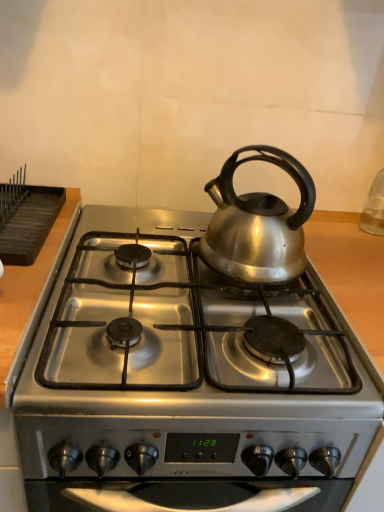
Question: Is black matte rack at upper left behind silver metallic kettle at center?

Choices:
 (A) no
 (B) yes

Answer: (B)

Question: Is black matte rack at upper left closer to the viewer compared to silver metallic kettle at center?

Choices:
 (A) yes
 (B) no

Answer: (B)

Question: Does black matte rack at upper left appear on the right side of silver metallic kettle at center?

Choices:
 (A) yes
 (B) no

Answer: (B)

Question: Is black matte rack at upper left thinner than silver metallic kettle at center?

Choices:
 (A) yes
 (B) no

Answer: (B)

Question: Is silver metallic kettle at center at the back of black matte rack at upper left?

Choices:
 (A) yes
 (B) no

Answer: (B)

Question: Choose the correct answer: Is silver metallic kettle at center inside black matte rack at upper left or outside it?

Choices:
 (A) outside
 (B) inside

Answer: (A)

Question: Looking at the image, does silver metallic kettle at center seem bigger or smaller compared to black matte rack at upper left?

Choices:
 (A) big
 (B) small

Answer: (A)

Question: From their relative heights in the image, would you say silver metallic kettle at center is taller or shorter than black matte rack at upper left?

Choices:
 (A) tall
 (B) short

Answer: (A)

Question: Does point (236, 160) appear closer or farther from the camera than point (23, 242)?

Choices:
 (A) closer
 (B) farther

Answer: (B)

Question: In the image, is satin silver gas stove at center on the left side or the right side of black matte rack at upper left?

Choices:
 (A) left
 (B) right

Answer: (B)

Question: Considering the positions of satin silver gas stove at center and black matte rack at upper left in the image, is satin silver gas stove at center wider or thinner than black matte rack at upper left?

Choices:
 (A) thin
 (B) wide

Answer: (B)

Question: From the image's perspective, is satin silver gas stove at center positioned above or below black matte rack at upper left?

Choices:
 (A) below
 (B) above

Answer: (A)

Question: Does point (248, 453) appear closer or farther from the camera than point (31, 251)?

Choices:
 (A) closer
 (B) farther

Answer: (A)

Question: Is black matte rack at upper left in front of or behind satin silver gas stove at center in the image?

Choices:
 (A) front
 (B) behind

Answer: (B)

Question: From a real-world perspective, is black matte rack at upper left above or below satin silver gas stove at center?

Choices:
 (A) above
 (B) below

Answer: (A)